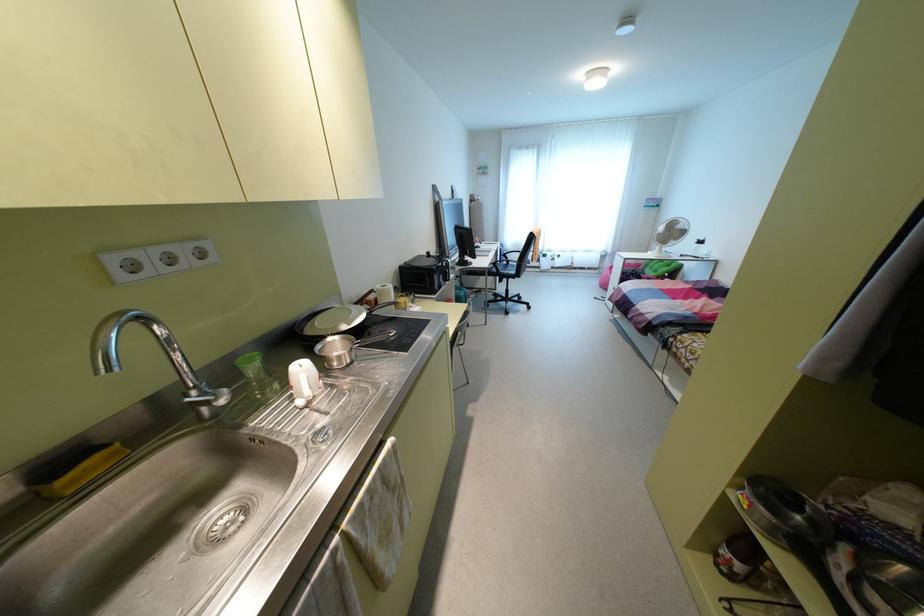
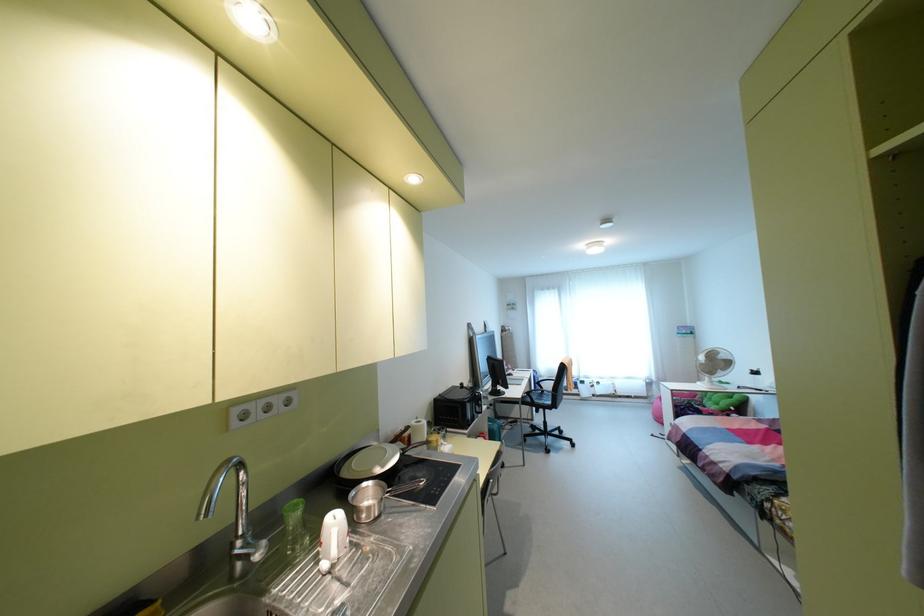
Question: In a continuous first-person perspective shot, in which direction is the camera moving?

Choices:
 (A) Left
 (B) Right
 (C) Forward
 (D) Backward

Answer: (D)